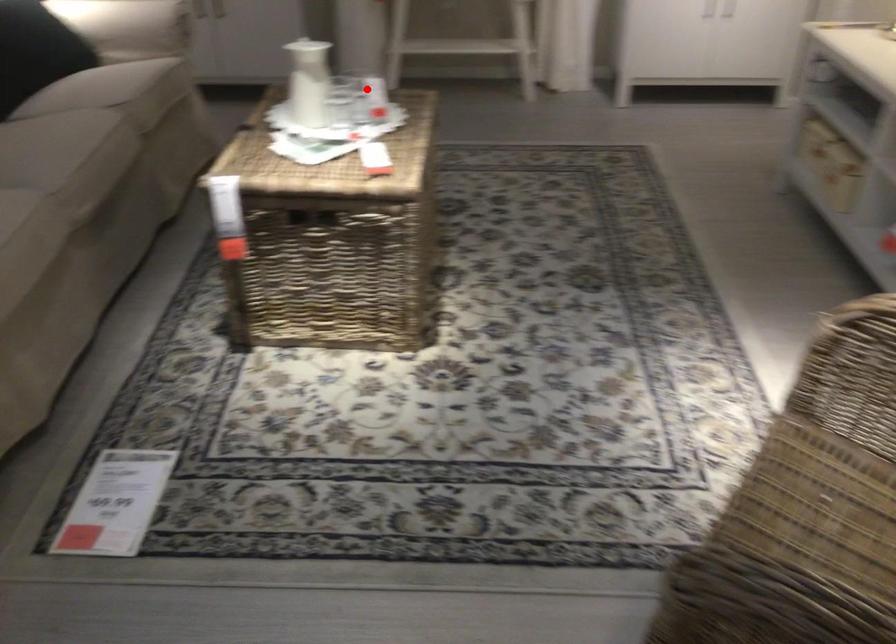
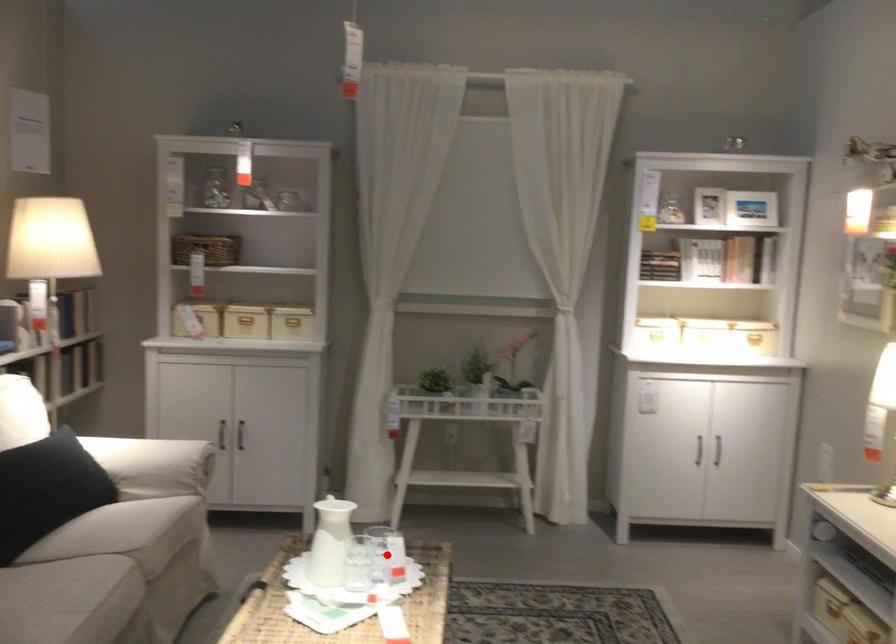
I am providing you with two images of the same scene from different viewpoints. A red point is marked on the first image and another point is marked on the second image. Is the red point in image1 aligned with the point shown in image2?

Yes